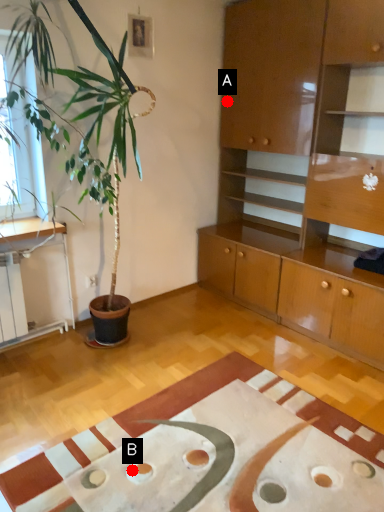
Question: Two points are circled on the image, labeled by A and B beside each circle. Which point is closer to the camera?

Choices:
 (A) A is closer
 (B) B is closer

Answer: (B)